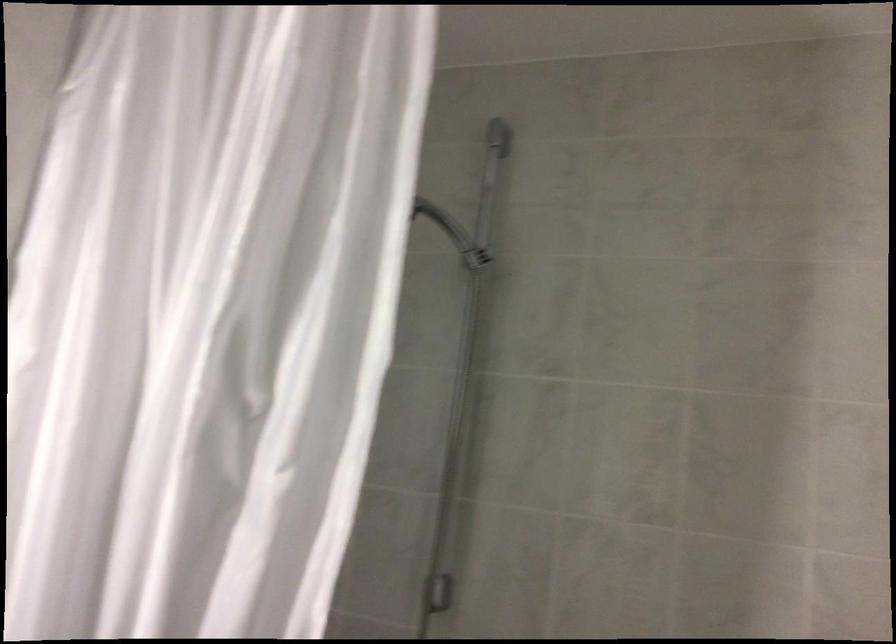
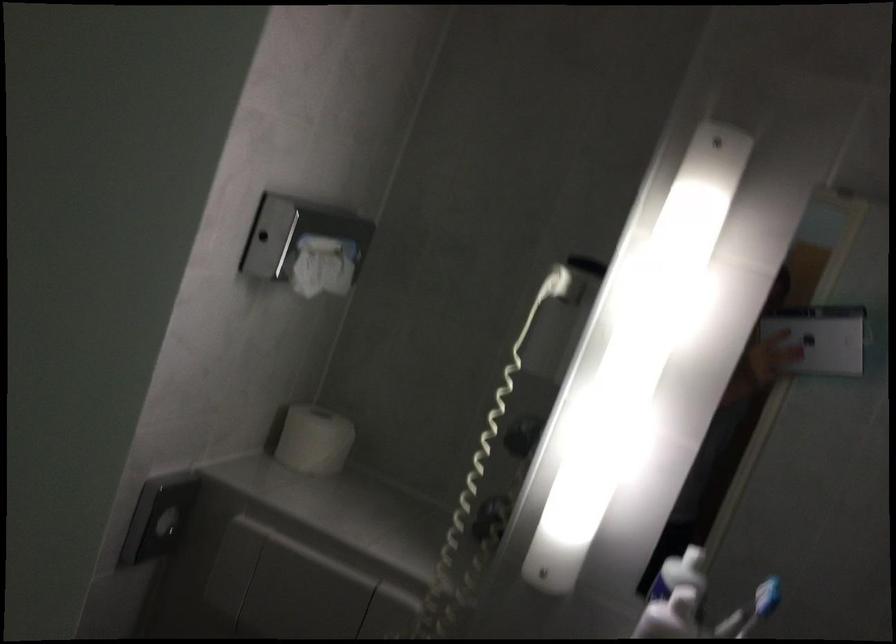
Question: The camera is either moving clockwise (left) or counter-clockwise (right) around the object. The first image is from the beginning of the video and the second image is from the end. Is the camera moving left or right when shooting the video?

Choices:
 (A) Left
 (B) Right

Answer: (B)